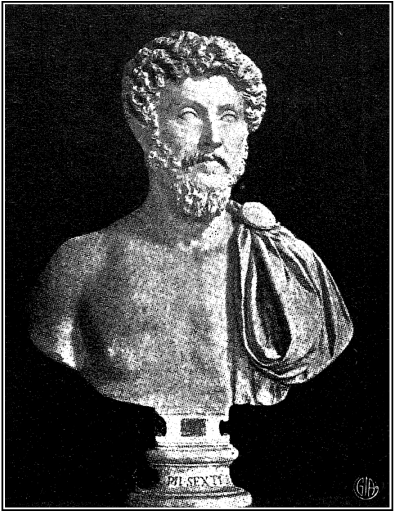
I want to click on pedestal, so click(x=196, y=459).